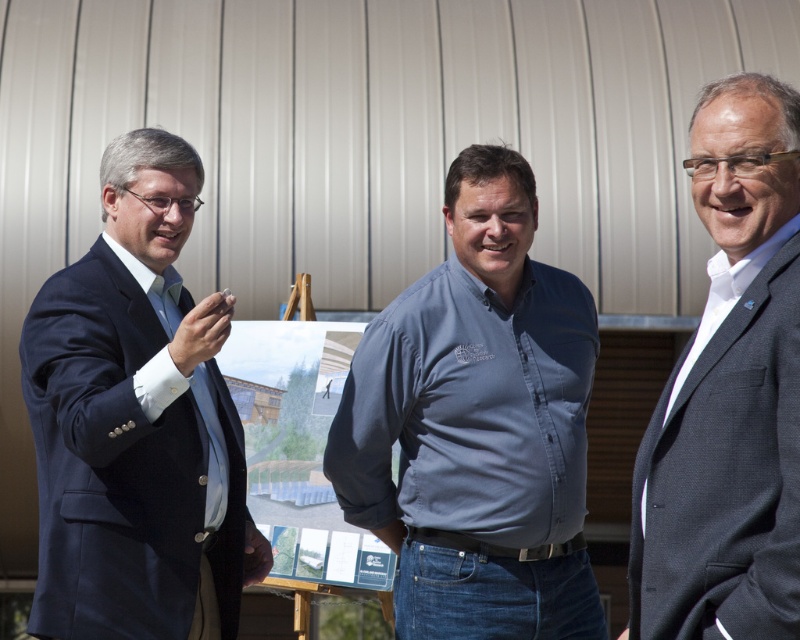
Question: Which point is farther to the camera?

Choices:
 (A) (202, 483)
 (B) (736, 605)

Answer: (A)

Question: Which of these objects is positioned farthest from the matte blue tie at left?

Choices:
 (A) dark blue suit at left
 (B) dark gray suit at center

Answer: (B)

Question: Can you confirm if dark blue suit at left is bigger than matte blue tie at left?

Choices:
 (A) yes
 (B) no

Answer: (A)

Question: Is blue cotton shirt at center positioned before dark gray suit at center?

Choices:
 (A) yes
 (B) no

Answer: (B)

Question: Which of the following is the closest to the observer?

Choices:
 (A) blue cotton shirt at center
 (B) dark gray suit at center
 (C) matte blue tie at left

Answer: (B)

Question: Can you confirm if dark gray suit at center is positioned below matte blue tie at left?

Choices:
 (A) no
 (B) yes

Answer: (A)